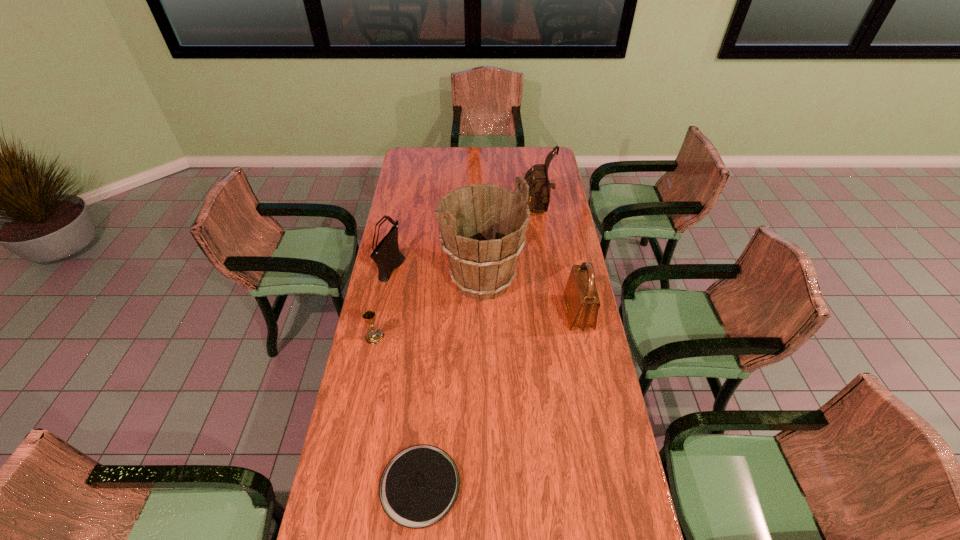
Where is `vacant space situated on the front-facing side of the farthest object`? The width and height of the screenshot is (960, 540). vacant space situated on the front-facing side of the farthest object is located at coordinates (472, 211).

Locate an element on the screen. Image resolution: width=960 pixels, height=540 pixels. vacant space located 0.300m on the front of the second nearest shoulder bag is located at coordinates (376, 345).

Image resolution: width=960 pixels, height=540 pixels. I want to click on free space located 0.290m on the front flap of the nearest shoulder bag, so click(x=491, y=313).

Find the location of a particular element. The height and width of the screenshot is (540, 960). free location located on the front flap of the nearest shoulder bag is located at coordinates (498, 313).

You are a GUI agent. You are given a task and a screenshot of the screen. Output one action in this format:
    pyautogui.click(x=<x>, y=<y>)
    Task: Click on the vacant space located 0.220m on the front flap of the nearest shoulder bag
    The height and width of the screenshot is (540, 960).
    Given the screenshot: What is the action you would take?
    pyautogui.click(x=509, y=313)

At what (x,y) coordinates should I click in order to perform the action: click on vacant space located on the front of the chalice. Please return your answer as a coordinate pair (x, y). This screenshot has width=960, height=540. Looking at the image, I should click on (361, 405).

Where is `vacant space located on the right of the nearest object`? vacant space located on the right of the nearest object is located at coordinates (543, 485).

Find the location of a particular element. The width and height of the screenshot is (960, 540). shoulder bag present at the left edge is located at coordinates (387, 256).

You are a GUI agent. You are given a task and a screenshot of the screen. Output one action in this format:
    pyautogui.click(x=<x>, y=<y>)
    Task: Click on the chalice at the left edge
    
    Given the screenshot: What is the action you would take?
    pyautogui.click(x=374, y=336)

This screenshot has width=960, height=540. I want to click on pancake present at the left edge, so click(x=419, y=486).